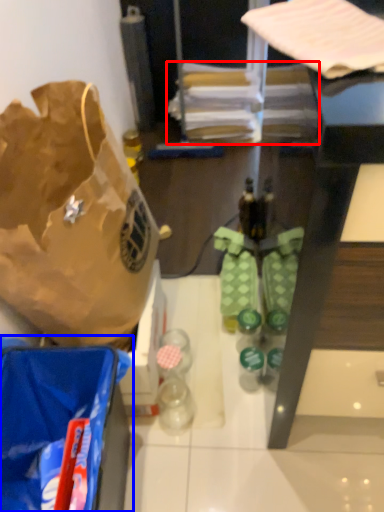
Question: Which object appears farthest to the camera in this image, wrapping paper (highlighted by a red box) or plastic bag (highlighted by a blue box)?

Choices:
 (A) wrapping paper
 (B) plastic bag

Answer: (A)